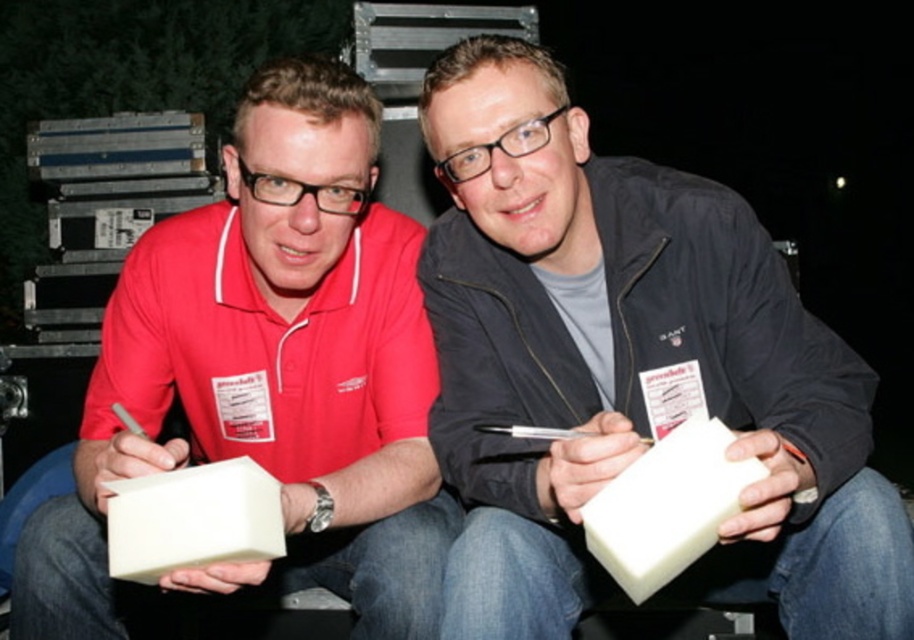
You are a photographer at a night event and need to capture a photo of both the matte black jacket at center and the matte red shirt at center. Which person should you focus on first if you want to ensure the taller individual is in focus?

The matte red shirt at center is taller than the matte black jacket at center, so you should focus on the matte red shirt at center first to ensure the taller individual is in focus.

You are a photographer positioned behind both individuals. You need to capture a photo where both the matte black jacket at center and the matte red shirt at center are clearly visible. Which one will appear larger in the photo?

The matte black jacket at center will appear larger in the photo because it is closer to the viewer than the matte red shirt at center.

You are standing in front of the two people in the image. Which object is exactly at the point marked as (630,369)?

The matte black jacket at center is exactly at the point marked as (630,369).